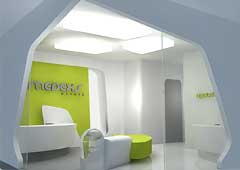
Where is `lime green wall`? This screenshot has height=170, width=240. lime green wall is located at coordinates (76, 108).